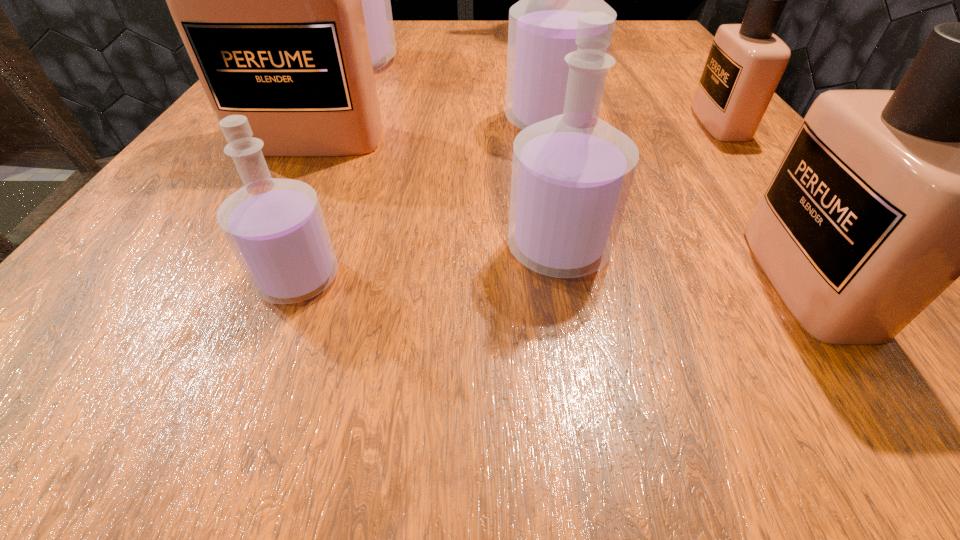
Locate an element on the screen. This screenshot has height=540, width=960. free space at the near edge is located at coordinates (703, 348).

Find the location of a particular element. This screenshot has width=960, height=540. free space at the left edge is located at coordinates (290, 171).

In the image, there is a desktop. What are the coordinates of `free space at the right edge` in the screenshot? It's located at (757, 159).

Find the location of a particular element. Image resolution: width=960 pixels, height=540 pixels. blank space at the near left corner of the desktop is located at coordinates (124, 360).

Locate an element on the screen. free region at the far right corner of the desktop is located at coordinates (656, 31).

The width and height of the screenshot is (960, 540). I want to click on vacant area that lies between the smallest beige perfume and the leftmost beige perfume, so click(x=515, y=131).

This screenshot has width=960, height=540. What are the coordinates of `empty space between the third biggest purple perfume and the nearest beige perfume` in the screenshot? It's located at (684, 264).

This screenshot has width=960, height=540. I want to click on vacant space in between the smallest beige perfume and the second farthest purple perfume, so click(635, 122).

Where is `empty space that is in between the biggest beige perfume and the smallest beige perfume`? empty space that is in between the biggest beige perfume and the smallest beige perfume is located at coordinates (515, 131).

Identify the location of free spot between the third smallest purple perfume and the farthest purple perfume. (452, 92).